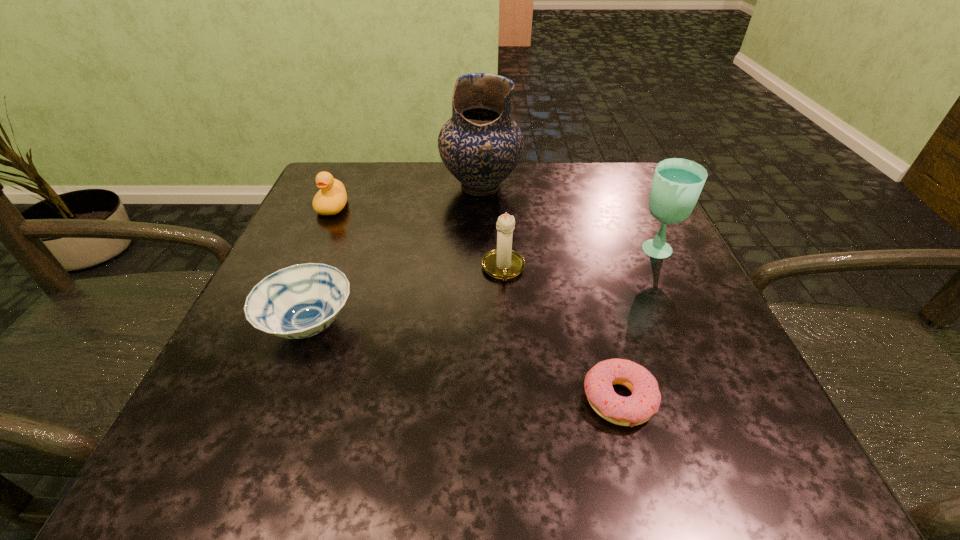
Find the location of a particular element. the tallest object is located at coordinates (480, 145).

At what (x,y) coordinates should I click in order to perform the action: click on the second tallest object. Please return your answer as a coordinate pair (x, y). The height and width of the screenshot is (540, 960). Looking at the image, I should click on (677, 183).

Where is `the rightmost object`? the rightmost object is located at coordinates (677, 183).

What are the coordinates of `the fourth shortest object` in the screenshot? It's located at [503, 263].

Image resolution: width=960 pixels, height=540 pixels. Find the location of `duck`. duck is located at coordinates pyautogui.click(x=331, y=198).

Identify the location of the second shortest object. The image size is (960, 540). (300, 301).

The height and width of the screenshot is (540, 960). In order to click on soup bowl in this screenshot , I will do `click(300, 301)`.

Find the location of a particular element. The width and height of the screenshot is (960, 540). the shortest object is located at coordinates (633, 410).

At what (x,y) coordinates should I click in order to perform the action: click on doughnut. Please return your answer as a coordinate pair (x, y). This screenshot has height=540, width=960. Looking at the image, I should click on (633, 410).

Identify the location of blank space located 0.250m on the right of the pottery. This screenshot has width=960, height=540. (627, 186).